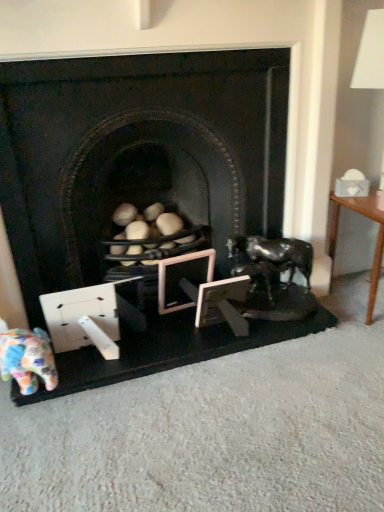
Question: Is shiny black horse at right spatially inside matte black fireplace at center, or outside of it?

Choices:
 (A) outside
 (B) inside

Answer: (B)

Question: From a real-world perspective, relative to matte black fireplace at center, is shiny black horse at right vertically above or below?

Choices:
 (A) above
 (B) below

Answer: (B)

Question: Which of these objects is positioned farthest from the shiny black horse at right?

Choices:
 (A) wooden picture frame at center, acting as the 2th picture frame starting from the left
 (B) wooden picture frame at center, marked as the 2th picture frame in a right-to-left arrangement
 (C) matte black fireplace at center
 (D) wooden table at right
 (E) multicolored fabric elephant at lower left

Answer: (E)

Question: Which object is the farthest from the wooden picture frame at center, arranged as the first picture frame when viewed from the right?

Choices:
 (A) wooden picture frame at center, marked as the 2th picture frame in a right-to-left arrangement
 (B) matte black fireplace at center
 (C) multicolored fabric elephant at lower left
 (D) wooden table at right
 (E) shiny black horse at right

Answer: (C)